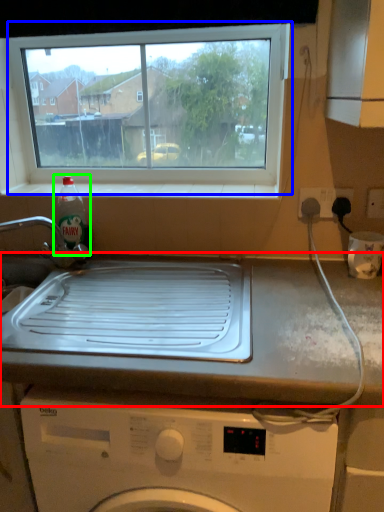
Question: Which object is positioned closest to countertop (highlighted by a red box)? Select from window (highlighted by a blue box) and bottle (highlighted by a green box).

Choices:
 (A) window
 (B) bottle

Answer: (B)